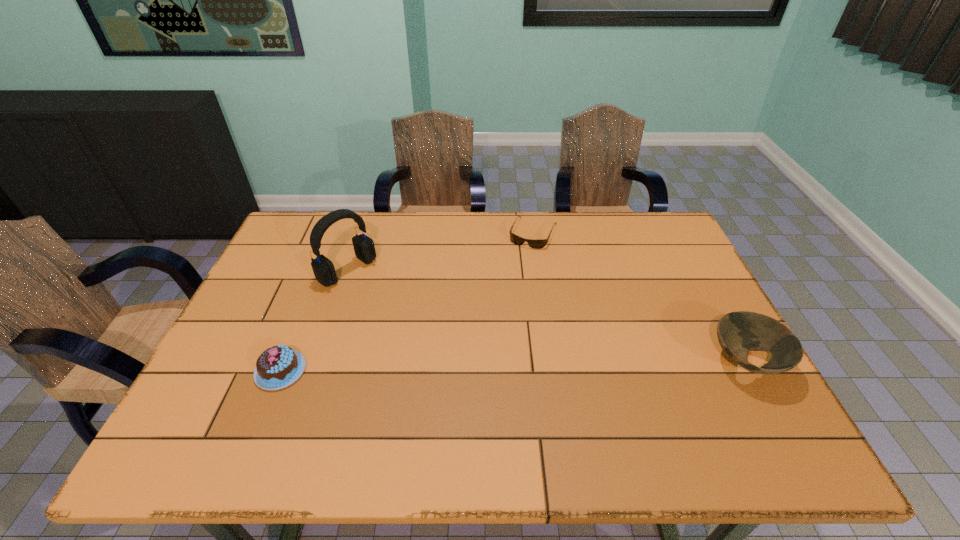
Locate an element on the screen. The width and height of the screenshot is (960, 540). free space that is in between the chocolate cake and the second tallest object is located at coordinates (513, 366).

Find the location of a particular element. The width and height of the screenshot is (960, 540). free spot between the shortest object and the bowl is located at coordinates (639, 297).

Locate an element on the screen. The image size is (960, 540). free space between the farthest object and the third tallest object is located at coordinates (407, 301).

Image resolution: width=960 pixels, height=540 pixels. In order to click on free point between the farthest object and the headset in this screenshot , I will do `click(441, 251)`.

Identify the location of free space between the third tallest object and the third nearest object. (314, 321).

Locate an element on the screen. This screenshot has width=960, height=540. vacant space that's between the third shortest object and the tallest object is located at coordinates (546, 316).

Locate an element on the screen. This screenshot has height=540, width=960. free spot between the bowl and the chocolate cake is located at coordinates (513, 366).

The width and height of the screenshot is (960, 540). Identify the location of vacant region between the bowl and the sunglasses. (639, 297).

Find the location of `vacant space that is in between the tallest object and the farthest object`. vacant space that is in between the tallest object and the farthest object is located at coordinates (441, 251).

Choose which object is the nearest neighbor to the chocolate cake. Please provide its 2D coordinates. Your answer should be formatted as a tuple, i.e. [(x, y)], where the tuple contains the x and y coordinates of a point satisfying the conditions above.

[(324, 271)]